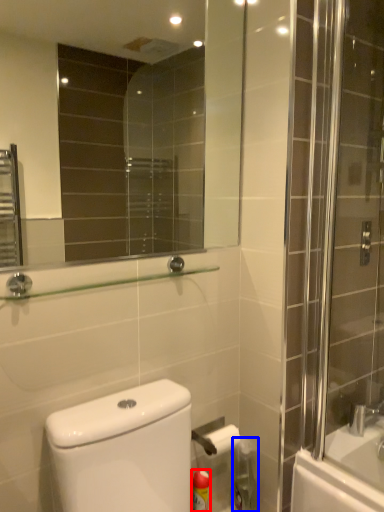
Question: Which of the following is the closest to the observer, cleaning product (highlighted by a red box) or cleaning product (highlighted by a blue box)?

Choices:
 (A) cleaning product
 (B) cleaning product

Answer: (A)